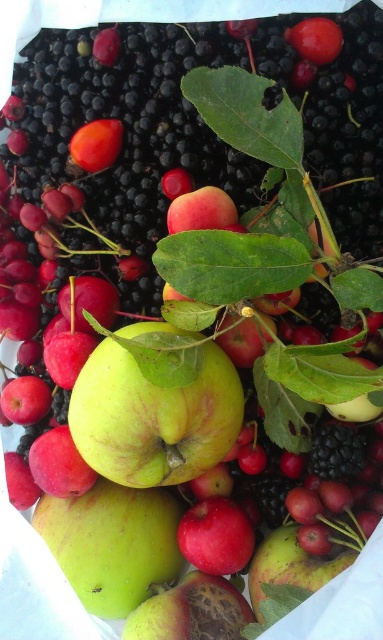
You are a fruit vendor arranging fruits on a display. You have a green matte apple at center and a smooth orange fruit at upper left. Which fruit is positioned closer to the front of the display?

The green matte apple at center is closer to the viewer than the smooth orange fruit at upper left, so it is positioned closer to the front of the display.

You are a fruit seller who wants to place a price tag between the green matte apple at center and the smooth orange fruit at upper left. The price tag is 2 inches wide. Can you fit it between them without moving the fruits?

The distance between the green matte apple at center and the smooth orange fruit at upper left is 13.57 inches. Since the price tag is only 2 inches wide, there is sufficient space to place it between them without moving the fruits.